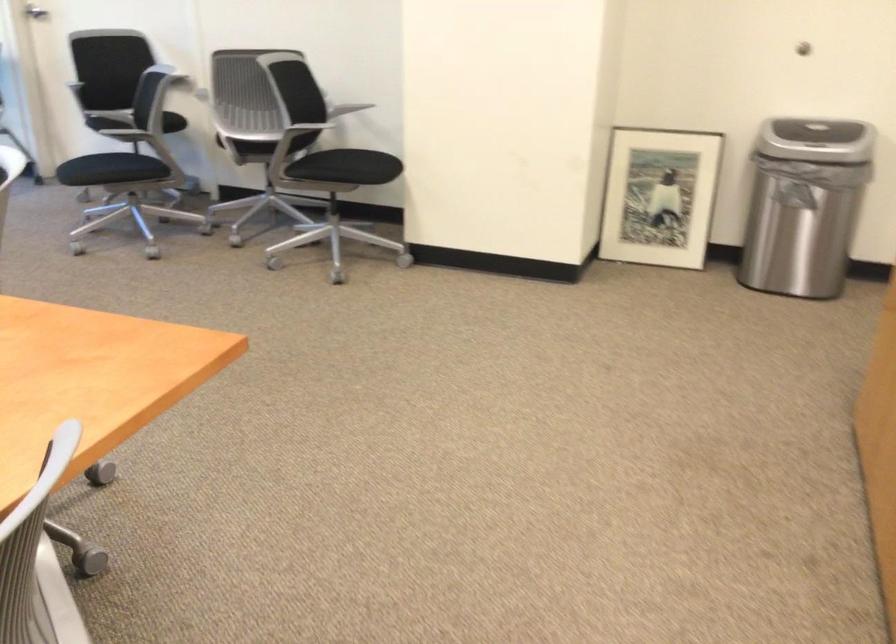
Find where to turn the silver door handle. Please return your answer as a coordinate pair (x, y).

(36, 12)